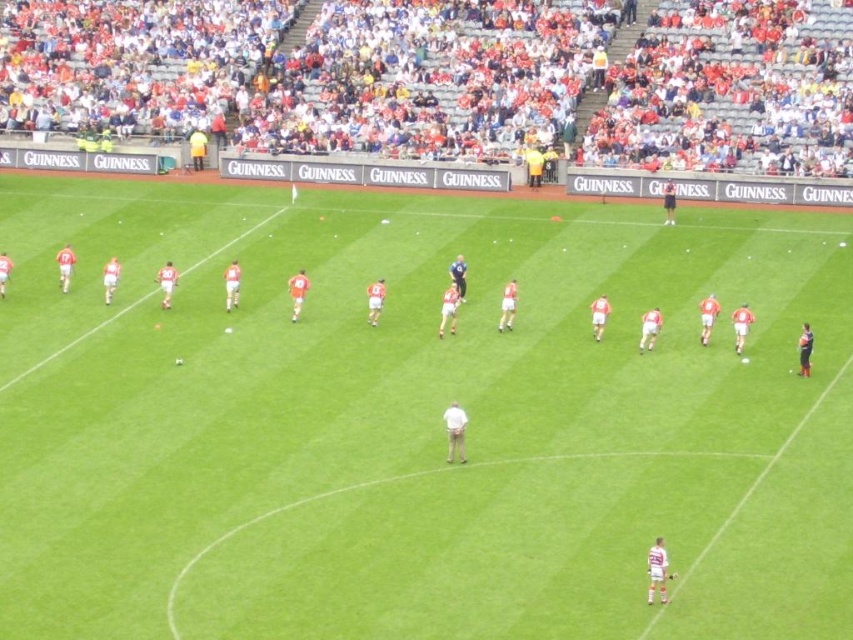
You are a photographer at the Gaelic football match. You want to take a photo of the white matte soccer ball at center without the white plastic seats at upper center appearing too large in the background. Should you move closer to or farther away from the ball?

You should move closer to the white matte soccer ball at center. Since the white plastic seats at upper center are larger in size compared to the ball, moving closer to the ball will reduce the apparent size of the seats in the background, making them less prominent in the photo.

You are a photographer trying to capture a clear shot of the white matte soccer ball at center without any obstructions. Given the white plastic seats at upper center, would you need to adjust your angle to avoid them?

The white plastic seats at upper center are located above the white matte soccer ball at center, so adjusting your angle downward would help avoid obstruction from the seats.

You are a photographer trying to capture a closeup of the white jersey at center. You are currently standing at the white plastic seats at upper center. Considering the size of the objects, do you think you can get a clear shot without zooming in?

The white plastic seats at upper center is bigger than white jersey at center, so you can get a clear shot without zooming in because the seats are larger and closer to you than the jersey.